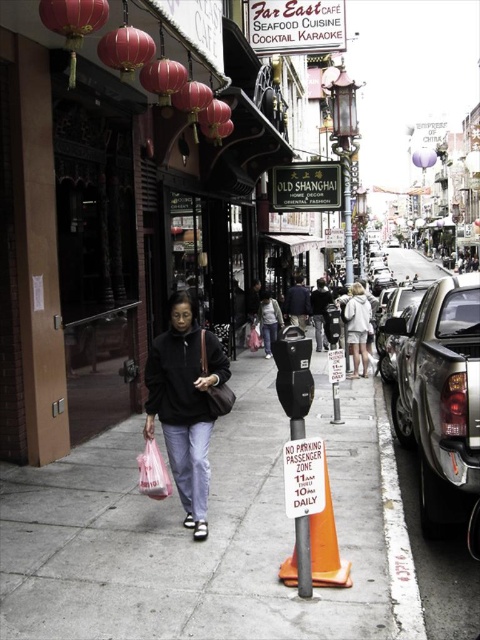
Is light gray sweater at center positioned before brown leather handbag at center?

No, it is behind brown leather handbag at center.

Who is shorter, light gray sweater at center or brown leather handbag at center?

brown leather handbag at center

Which is behind, point (277, 316) or point (222, 416)?

The point (277, 316) is more distant.

The width and height of the screenshot is (480, 640). What are the coordinates of `light gray sweater at center` in the screenshot? It's located at (268, 321).

This screenshot has height=640, width=480. Describe the element at coordinates (296, 26) in the screenshot. I see `black plastic sign at upper center` at that location.

Between point (265, 20) and point (296, 289), which one is positioned in front?

Point (265, 20)

Identify the location of black plastic sign at upper center. (296, 26).

Can you confirm if gray concrete sidewalk at center is positioned below orange traffic cone at lower center?

Indeed, gray concrete sidewalk at center is positioned under orange traffic cone at lower center.

Between point (256, 438) and point (349, 576), which one is positioned behind?

Positioned behind is point (256, 438).

Image resolution: width=480 pixels, height=640 pixels. In order to click on gray concrete sidewalk at center in this screenshot , I will do `click(190, 532)`.